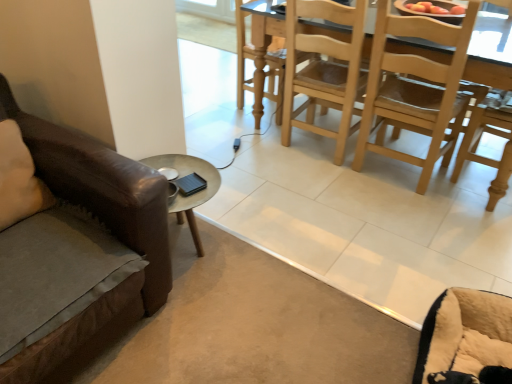
Question: Is beige plush swivel chair at lower right wider or thinner than light brown wood chair at center?

Choices:
 (A) wide
 (B) thin

Answer: (B)

Question: From a real-world perspective, is beige plush swivel chair at lower right physically located above or below light brown wood chair at center?

Choices:
 (A) below
 (B) above

Answer: (A)

Question: Considering the real-world distances, which object is closest to the beige plush swivel chair at lower right?

Choices:
 (A) beige fabric pillow at left
 (B) light brown wooden table at upper right
 (C) light brown wood chair at center

Answer: (B)

Question: Estimate the real-world distances between objects in this image. Which object is farther from the beige fabric pillow at left?

Choices:
 (A) light brown wood chair at center
 (B) beige plush swivel chair at lower right
 (C) light brown wooden table at upper right

Answer: (C)